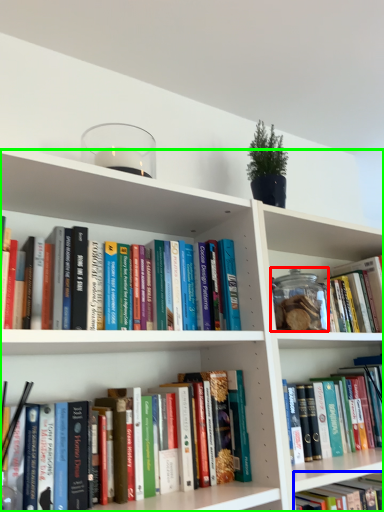
Question: Which is farther away from glass jar (highlighted by a red box)? book (highlighted by a blue box) or bookcase (highlighted by a green box)?

Choices:
 (A) book
 (B) bookcase

Answer: (A)